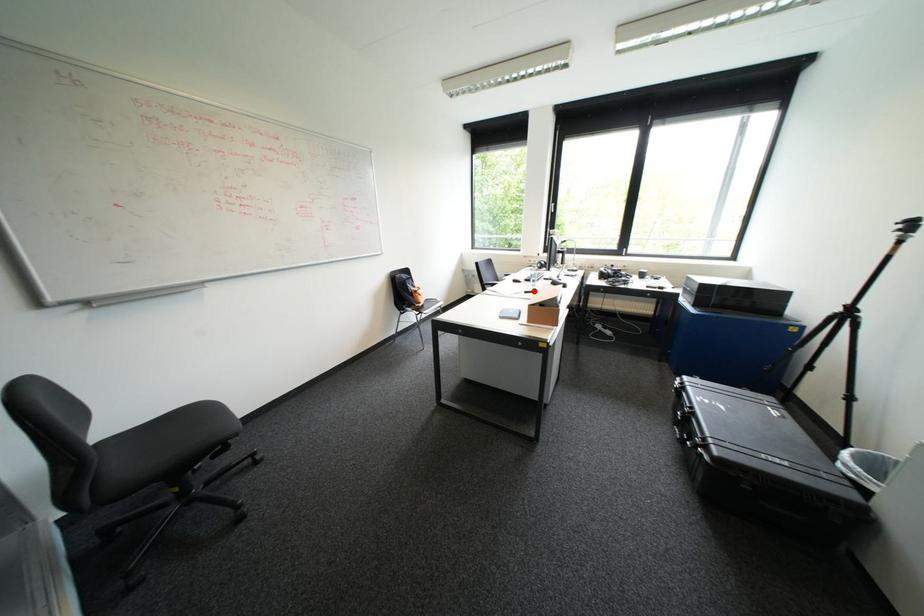
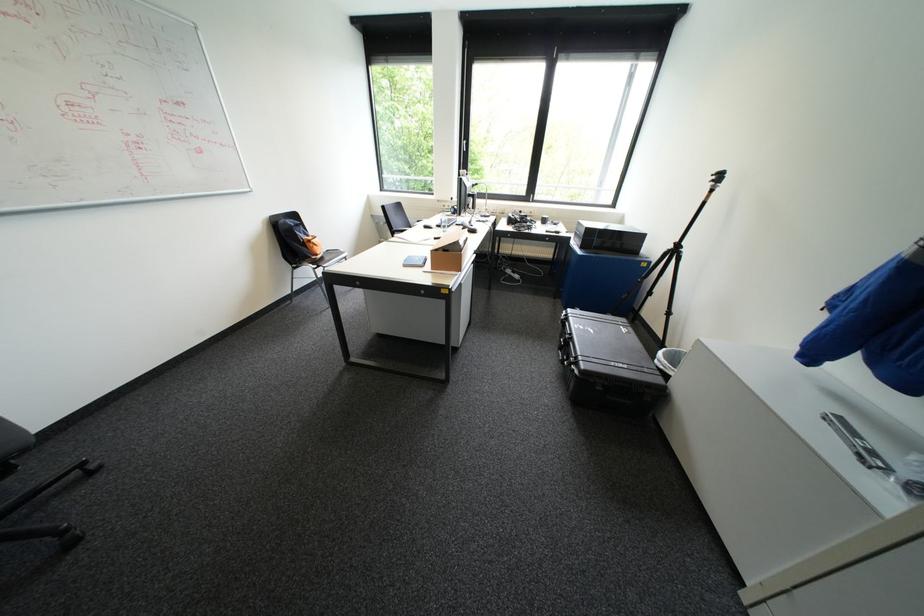
The point at the highlighted location is marked in the first image. Where is the corresponding point in the second image?

(444, 237)